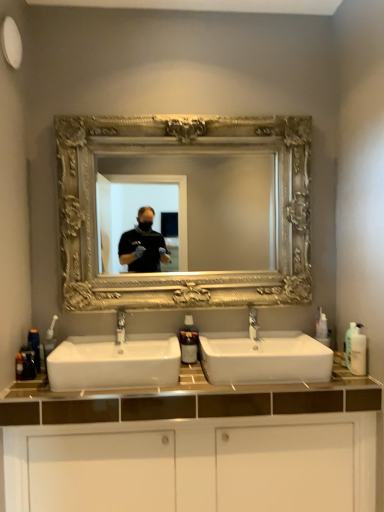
The width and height of the screenshot is (384, 512). Identify the location of vacant area located to the right-hand side of matte silver faucet at center, acting as the 2th tap starting from the right. (151, 352).